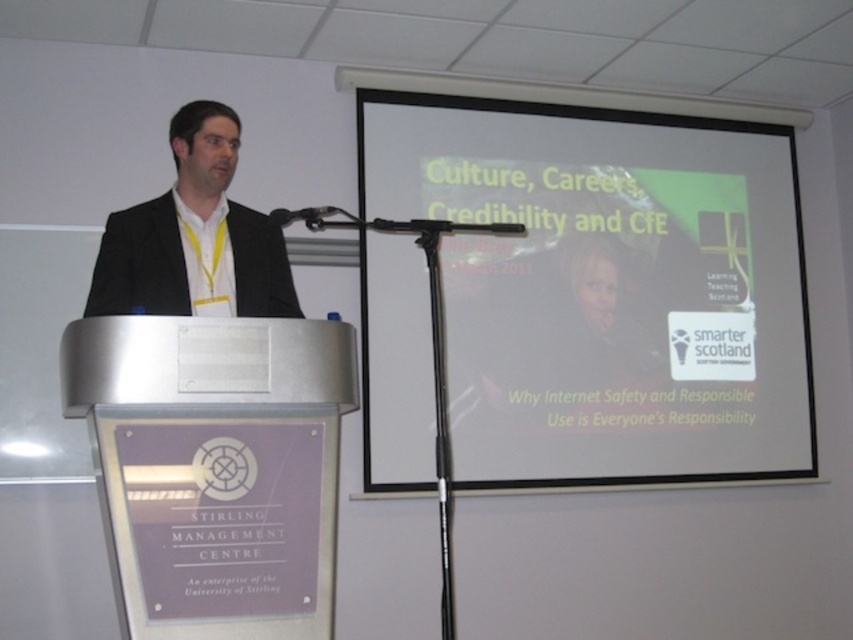
Question: Among these points, which one is farthest from the camera?

Choices:
 (A) (683, 301)
 (B) (215, 292)
 (C) (302, 212)

Answer: (A)

Question: Which point appears closest to the camera in this image?

Choices:
 (A) (97, 300)
 (B) (334, 211)
 (C) (749, 454)

Answer: (A)

Question: Is white matte projection screen at upper right closer to camera compared to black metallic microphone at center?

Choices:
 (A) no
 (B) yes

Answer: (B)

Question: Which point appears closest to the camera in this image?

Choices:
 (A) (115, 298)
 (B) (310, 224)
 (C) (410, 369)

Answer: (B)

Question: Is white matte projection screen at upper right positioned behind black suit at left?

Choices:
 (A) no
 (B) yes

Answer: (B)

Question: Is white matte projection screen at upper right to the right of black suit at left from the viewer's perspective?

Choices:
 (A) yes
 (B) no

Answer: (A)